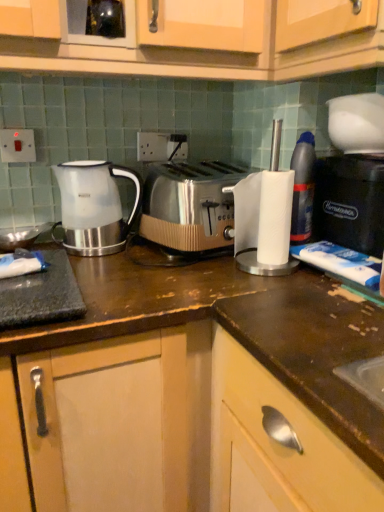
The width and height of the screenshot is (384, 512). Describe the element at coordinates (161, 146) in the screenshot. I see `white plastic electric outlet at center, the 2th electric outlet viewed from the left` at that location.

Locate an element on the screen. Image resolution: width=384 pixels, height=512 pixels. white glossy kettle at left is located at coordinates (94, 206).

What are the coordinates of `satin silver toaster at center` in the screenshot? It's located at (190, 205).

The width and height of the screenshot is (384, 512). Identify the location of white plastic electric outlet at upper left, which is the second electric outlet in right-to-left order. (17, 145).

Does white plastic electric outlet at center, the 1th electric outlet positioned from the back, lie in front of satin silver toaster at center?

No, white plastic electric outlet at center, the 1th electric outlet positioned from the back, is further to the viewer.

From the picture: Is white plastic electric outlet at center, acting as the second electric outlet starting from the front, looking in the opposite direction of satin silver toaster at center?

No, satin silver toaster at center is not at the back of white plastic electric outlet at center, acting as the second electric outlet starting from the front.

Can you confirm if translucent plastic bottle at right is taller than white plastic electric outlet at center, acting as the second electric outlet starting from the front?

Indeed, translucent plastic bottle at right has a greater height compared to white plastic electric outlet at center, acting as the second electric outlet starting from the front.

In order to click on the 1st electric outlet positioned above the translucent plastic bottle at right (from a real-world perspective) in this screenshot , I will do `click(161, 146)`.

In terms of size, does translucent plastic bottle at right appear bigger or smaller than white plastic electric outlet at center, acting as the second electric outlet starting from the front?

translucent plastic bottle at right is bigger than white plastic electric outlet at center, acting as the second electric outlet starting from the front.

Which is more to the right, white glossy kettle at left or black plastic coffee machine at right?

black plastic coffee machine at right.

In the image, is white glossy kettle at left positioned in front of or behind black plastic coffee machine at right?

Clearly, white glossy kettle at left is behind black plastic coffee machine at right.

Is white glossy kettle at left taller or shorter than black plastic coffee machine at right?

Considering their sizes, white glossy kettle at left has more height than black plastic coffee machine at right.

Is black plastic coffee machine at right completely or partially inside white glossy kettle at left?

Definitely not — black plastic coffee machine at right is not inside white glossy kettle at left.

From a real-world perspective, is translucent plastic bottle at right physically located above or below black plastic coffee machine at right?

From a real-world perspective, translucent plastic bottle at right is physically above black plastic coffee machine at right.

From the image's perspective, is translucent plastic bottle at right positioned above or below black plastic coffee machine at right?

translucent plastic bottle at right is situated higher than black plastic coffee machine at right in the image.

From the picture: Which of these two, translucent plastic bottle at right or black plastic coffee machine at right, is bigger?

With larger size is black plastic coffee machine at right.

Is the position of satin silver toaster at center more distant than that of white glossy kettle at left?

No, it is not.

From the image's perspective, is satin silver toaster at center under white glossy kettle at left?

Correct, satin silver toaster at center appears lower than white glossy kettle at left in the image.

Which point is more forward, (155, 177) or (96, 234)?

The point (96, 234) is closer.

From the image's perspective, would you say white plastic electric outlet at upper left, the 1th electric outlet in the front-to-back sequence, is shown under white plastic electric outlet at center, acting as the second electric outlet starting from the front?

Yes, from the image's perspective, white plastic electric outlet at upper left, the 1th electric outlet in the front-to-back sequence, is beneath white plastic electric outlet at center, acting as the second electric outlet starting from the front.

Considering the relative positions of white plastic electric outlet at upper left, which appears as the 1th electric outlet when viewed from the left, and white plastic electric outlet at center, the 2th electric outlet viewed from the left, in the image provided, is white plastic electric outlet at upper left, which appears as the 1th electric outlet when viewed from the left, to the right of white plastic electric outlet at center, the 2th electric outlet viewed from the left, from the viewer's perspective?

In fact, white plastic electric outlet at upper left, which appears as the 1th electric outlet when viewed from the left, is to the left of white plastic electric outlet at center, the 2th electric outlet viewed from the left.

Is white plastic electric outlet at upper left, the 1th electric outlet in the front-to-back sequence, shorter than white plastic electric outlet at center, the 2th electric outlet viewed from the left?

Yes, white plastic electric outlet at upper left, the 1th electric outlet in the front-to-back sequence, is shorter than white plastic electric outlet at center, the 2th electric outlet viewed from the left.

Choose the correct answer: Is white glossy kettle at left inside white plastic electric outlet at center, the 1th electric outlet positioned from the back, or outside it?

The correct answer is: outside.

Is white glossy kettle at left not near white plastic electric outlet at center, the 1th electric outlet positioned from the back?

No, white glossy kettle at left is not far away from white plastic electric outlet at center, the 1th electric outlet positioned from the back.

Relative to white plastic electric outlet at center, the 2th electric outlet viewed from the left, is white glossy kettle at left in front or behind?

white glossy kettle at left is positioned closer to the viewer than white plastic electric outlet at center, the 2th electric outlet viewed from the left.

Does point (88, 189) appear closer or farther from the camera than point (159, 156)?

Point (88, 189).

Locate an element on the screen. This screenshot has height=512, width=384. toaster below the white plastic electric outlet at center, the 1th electric outlet in the right-to-left sequence (from the image's perspective) is located at coordinates (190, 205).

What are the coordinates of `bottle in front of the white plastic electric outlet at center, acting as the second electric outlet starting from the front` in the screenshot? It's located at (303, 188).

Based on their spatial positions, is translucent plastic bottle at right or satin silver toaster at center closer to white plastic electric outlet at center, the 1th electric outlet positioned from the back?

satin silver toaster at center is closer to white plastic electric outlet at center, the 1th electric outlet positioned from the back.

Considering their positions, is white glossy kettle at left positioned closer to black plastic coffee machine at right than satin silver toaster at center?

satin silver toaster at center.

Which object lies nearer to the anchor point white plastic electric outlet at upper left, which is counted as the second electric outlet, starting from the back, white glossy kettle at left or black plastic coffee machine at right?

Based on the image, white glossy kettle at left appears to be nearer to white plastic electric outlet at upper left, which is counted as the second electric outlet, starting from the back.

Based on their spatial positions, is white plastic electric outlet at center, the 2th electric outlet viewed from the left, or white plastic electric outlet at upper left, which is the second electric outlet in right-to-left order, closer to satin silver toaster at center?

white plastic electric outlet at center, the 2th electric outlet viewed from the left, is closer to satin silver toaster at center.

Looking at this image, from the image, which object appears to be nearer to black plastic coffee machine at right, white plastic electric outlet at upper left, which is the second electric outlet in right-to-left order, or satin silver toaster at center?

satin silver toaster at center is closer to black plastic coffee machine at right.

Estimate the real-world distances between objects in this image. Which object is further from satin silver toaster at center, white glossy kettle at left or white plastic electric outlet at upper left, which is the second electric outlet in right-to-left order?

Based on the image, white plastic electric outlet at upper left, which is the second electric outlet in right-to-left order, appears to be further to satin silver toaster at center.

Estimate the real-world distances between objects in this image. Which object is closer to white plastic electric outlet at center, the 1th electric outlet positioned from the back, translucent plastic bottle at right or white plastic electric outlet at upper left, which appears as the 1th electric outlet when viewed from the left?

Among the two, white plastic electric outlet at upper left, which appears as the 1th electric outlet when viewed from the left, is located nearer to white plastic electric outlet at center, the 1th electric outlet positioned from the back.

Which object lies further to the anchor point translucent plastic bottle at right, satin silver toaster at center or white plastic electric outlet at upper left, which is the second electric outlet in right-to-left order?

white plastic electric outlet at upper left, which is the second electric outlet in right-to-left order, is positioned further to the anchor translucent plastic bottle at right.

In order to click on electric outlet situated between white plastic electric outlet at upper left, which is counted as the second electric outlet, starting from the back, and translucent plastic bottle at right from left to right in this screenshot , I will do `click(161, 146)`.

The image size is (384, 512). I want to click on electric outlet between white plastic electric outlet at upper left, which appears as the 1th electric outlet when viewed from the left, and black plastic coffee machine at right, in the horizontal direction, so click(161, 146).

The image size is (384, 512). I want to click on toaster between white plastic electric outlet at center, the 1th electric outlet positioned from the back, and black plastic coffee machine at right from left to right, so point(190,205).

Identify the location of kettle between white plastic electric outlet at upper left, the 1th electric outlet in the front-to-back sequence, and translucent plastic bottle at right. Image resolution: width=384 pixels, height=512 pixels. (94, 206).